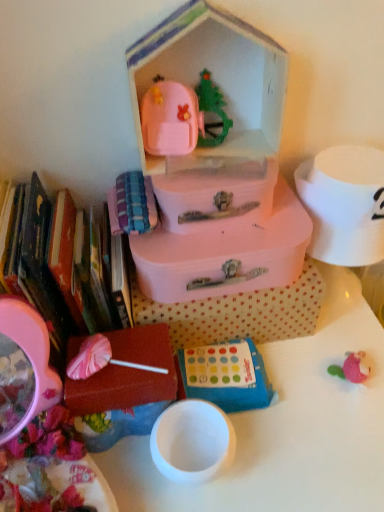
Where is `matte pink suitcase at center, arranged as the second storage box when viewed from the top`? This screenshot has width=384, height=512. matte pink suitcase at center, arranged as the second storage box when viewed from the top is located at coordinates (224, 254).

Find the location of `pink matte lollipop at lower left, the 1th storage box ordered from the bottom`. pink matte lollipop at lower left, the 1th storage box ordered from the bottom is located at coordinates (127, 373).

Where is `matte pink book at left`? This screenshot has height=512, width=384. matte pink book at left is located at coordinates (70, 268).

Describe the element at coordinates (227, 376) in the screenshot. I see `blue fabric game at center` at that location.

How much space does matte pink suitcase at center, which is the 4th storage box from bottom to top, occupy vertically?

matte pink suitcase at center, which is the 4th storage box from bottom to top, is 4.08 inches tall.

Find the location of a particular element. pink matte suitcase at center, the 2th storage box in the bottom-to-top sequence is located at coordinates (238, 313).

Is matte pink book at left in contact with matte pink suitcase at center, arranged as the second storage box when viewed from the top?

matte pink book at left and matte pink suitcase at center, arranged as the second storage box when viewed from the top, are clearly separated.

At what (x,y) coordinates should I click in order to perform the action: click on book lying below the matte pink suitcase at center, arranged as the second storage box when viewed from the top (from the image's perspective). Please return your answer as a coordinate pair (x, y). The height and width of the screenshot is (512, 384). Looking at the image, I should click on (70, 268).

Does matte pink book at left have a lesser width compared to matte pink suitcase at center, arranged as the 3th storage box when ordered from the bottom?

Incorrect, the width of matte pink book at left is not less than that of matte pink suitcase at center, arranged as the 3th storage box when ordered from the bottom.

From the matte pink suitcase at center, arranged as the 3th storage box when ordered from the bottom, count 2nd storage box to the right and point to it. Please provide its 2D coordinates.

[(238, 313)]

Looking at their sizes, would you say matte pink suitcase at center, arranged as the second storage box when viewed from the top, is wider or thinner than pink matte suitcase at center, the 2th storage box in the bottom-to-top sequence?

Clearly, matte pink suitcase at center, arranged as the second storage box when viewed from the top, has more width compared to pink matte suitcase at center, the 2th storage box in the bottom-to-top sequence.

Is matte pink suitcase at center, arranged as the 3th storage box when ordered from the bottom, beside pink matte suitcase at center, the 2th storage box in the bottom-to-top sequence?

Yes, matte pink suitcase at center, arranged as the 3th storage box when ordered from the bottom, is next to pink matte suitcase at center, the 2th storage box in the bottom-to-top sequence.

From a real-world perspective, relative to pink matte suitcase at center, the third storage box positioned from the top, is matte pink suitcase at center, arranged as the second storage box when viewed from the top, vertically above or below?

From a real-world perspective, matte pink suitcase at center, arranged as the second storage box when viewed from the top, is physically above pink matte suitcase at center, the third storage box positioned from the top.

Looking at their sizes, would you say pink matte suitcase at center, the third storage box positioned from the top, is wider or thinner than matte pink suitcase at center, which is the 4th storage box from bottom to top?

Clearly, pink matte suitcase at center, the third storage box positioned from the top, has less width compared to matte pink suitcase at center, which is the 4th storage box from bottom to top.

Which point is more forward, [281,333] or [162,215]?

The point [162,215] is more forward.

From the image's perspective, is pink matte suitcase at center, the 2th storage box in the bottom-to-top sequence, beneath matte pink suitcase at center, which is the 4th storage box from bottom to top?

Indeed, from the image's perspective, pink matte suitcase at center, the 2th storage box in the bottom-to-top sequence, is shown beneath matte pink suitcase at center, which is the 4th storage box from bottom to top.

In the scene shown: Is pink matte suitcase at center, the 2th storage box in the bottom-to-top sequence, positioned with its back to matte pink suitcase at center, positioned as the 1th storage box in top-to-bottom order?

pink matte suitcase at center, the 2th storage box in the bottom-to-top sequence, is not turned away from matte pink suitcase at center, positioned as the 1th storage box in top-to-bottom order.

From the image's perspective, is pink plastic suitcase at upper center over matte pink book at left?

Yes, from the image's perspective, pink plastic suitcase at upper center is over matte pink book at left.

Which object is thinner, pink plastic suitcase at upper center or matte pink book at left?

pink plastic suitcase at upper center is thinner.

Does pink plastic suitcase at upper center come behind matte pink book at left?

No, it is in front of matte pink book at left.

What's the angular difference between pink plastic suitcase at upper center and matte pink book at left's facing directions?

There is a 0.000755-degree angle between the facing directions of pink plastic suitcase at upper center and matte pink book at left.

Considering the sizes of matte pink suitcase at center, arranged as the second storage box when viewed from the top, and matte pink suitcase at center, which is the 4th storage box from bottom to top, in the image, is matte pink suitcase at center, arranged as the second storage box when viewed from the top, bigger or smaller than matte pink suitcase at center, which is the 4th storage box from bottom to top,?

In the image, matte pink suitcase at center, arranged as the second storage box when viewed from the top, appears to be larger than matte pink suitcase at center, which is the 4th storage box from bottom to top.

Is matte pink suitcase at center, arranged as the 3th storage box when ordered from the bottom, located outside matte pink suitcase at center, which is the 4th storage box from bottom to top?

Absolutely, matte pink suitcase at center, arranged as the 3th storage box when ordered from the bottom, is external to matte pink suitcase at center, which is the 4th storage box from bottom to top.

From a real-world perspective, is matte pink suitcase at center, arranged as the 3th storage box when ordered from the bottom, located higher than matte pink suitcase at center, which is the 4th storage box from bottom to top?

No, from a real-world perspective, matte pink suitcase at center, arranged as the 3th storage box when ordered from the bottom, is not over matte pink suitcase at center, which is the 4th storage box from bottom to top

Can you confirm if white glossy table at center is wider than blue fabric game at center?

Yes.

Does white glossy table at center turn towards blue fabric game at center?

No, white glossy table at center is not facing towards blue fabric game at center.

Visually, is white glossy table at center positioned to the left or to the right of blue fabric game at center?

Clearly, white glossy table at center is on the left of blue fabric game at center in the image.

Measure the distance between white glossy table at center and blue fabric game at center.

The distance of white glossy table at center from blue fabric game at center is 4.35 inches.

Can you confirm if pink matte lollipop at lower left, which is counted as the 4th storage box, starting from the top, is bigger than matte pink suitcase at center, arranged as the second storage box when viewed from the top?

No, pink matte lollipop at lower left, which is counted as the 4th storage box, starting from the top, is not bigger than matte pink suitcase at center, arranged as the second storage box when viewed from the top.

Is the depth of pink matte lollipop at lower left, the 1th storage box ordered from the bottom, less than that of matte pink suitcase at center, arranged as the second storage box when viewed from the top?

Yes, pink matte lollipop at lower left, the 1th storage box ordered from the bottom, is closer to the camera.

Is pink matte lollipop at lower left, the 1th storage box ordered from the bottom, facing towards matte pink suitcase at center, arranged as the 3th storage box when ordered from the bottom?

No, pink matte lollipop at lower left, the 1th storage box ordered from the bottom, does not turn towards matte pink suitcase at center, arranged as the 3th storage box when ordered from the bottom.

Considering the positions of objects pink matte lollipop at lower left, the 1th storage box ordered from the bottom, and matte pink suitcase at center, arranged as the second storage box when viewed from the top, in the image provided, who is more to the right, pink matte lollipop at lower left, the 1th storage box ordered from the bottom, or matte pink suitcase at center, arranged as the second storage box when viewed from the top,?

matte pink suitcase at center, arranged as the second storage box when viewed from the top.

This screenshot has height=512, width=384. Identify the location of the 2nd storage box to the right of the matte pink book at left, starting your count from the anchor. (224, 254).

Locate an element on the screen. the 1st storage box above the pink matte suitcase at center, the 2th storage box in the bottom-to-top sequence (from the image's perspective) is located at coordinates (224, 254).

Based on their spatial positions, is matte pink suitcase at center, which is the 4th storage box from bottom to top, or matte pink book at left further from pink plastic suitcase at upper center?

matte pink book at left is positioned further to the anchor pink plastic suitcase at upper center.

Based on their spatial positions, is matte pink book at left or blue fabric game at center closer to pink matte suitcase at center, the third storage box positioned from the top?

The object closer to pink matte suitcase at center, the third storage box positioned from the top, is blue fabric game at center.

Which object lies further to the anchor point matte pink suitcase at center, arranged as the second storage box when viewed from the top, pink plastic suitcase at upper center or blue fabric game at center?

The object further to matte pink suitcase at center, arranged as the second storage box when viewed from the top, is blue fabric game at center.

Which object lies nearer to the anchor point pink plastic suitcase at upper center, matte pink book at left or pink matte lollipop at lower left, the 1th storage box ordered from the bottom?

The object closer to pink plastic suitcase at upper center is matte pink book at left.

Based on their spatial positions, is pink matte lollipop at lower left, the 1th storage box ordered from the bottom, or blue fabric game at center further from matte pink suitcase at center, which is the 4th storage box from bottom to top?

blue fabric game at center lies further to matte pink suitcase at center, which is the 4th storage box from bottom to top, than the other object.

Considering their positions, is pink matte lollipop at lower left, the 1th storage box ordered from the bottom, positioned further to matte pink suitcase at center, which is the 4th storage box from bottom to top, than pink matte suitcase at center, the 2th storage box in the bottom-to-top sequence?

pink matte lollipop at lower left, the 1th storage box ordered from the bottom, lies further to matte pink suitcase at center, which is the 4th storage box from bottom to top, than the other object.

Which object lies further to the anchor point blue fabric game at center, matte pink book at left or pink plastic suitcase at upper center?

Among the two, pink plastic suitcase at upper center is located further to blue fabric game at center.

From the image, which object appears to be nearer to white glossy table at center, matte pink suitcase at center, arranged as the 3th storage box when ordered from the bottom, or blue fabric game at center?

blue fabric game at center lies closer to white glossy table at center than the other object.

Find the location of a particular element. The height and width of the screenshot is (512, 384). storage box between pink plastic suitcase at upper center and matte pink suitcase at center, arranged as the second storage box when viewed from the top, from top to bottom is located at coordinates (215, 196).

Locate an element on the screen. The height and width of the screenshot is (512, 384). box between matte pink book at left and matte pink suitcase at center, arranged as the 3th storage box when ordered from the bottom, in the horizontal direction is located at coordinates (218, 164).

The image size is (384, 512). Find the location of `toy between pink matte suitcase at center, the third storage box positioned from the top, and white glossy table at center vertically`. toy between pink matte suitcase at center, the third storage box positioned from the top, and white glossy table at center vertically is located at coordinates (227, 376).

At what (x,y) coordinates should I click in order to perform the action: click on toy between pink plastic suitcase at upper center and white glossy table at center from top to bottom. Please return your answer as a coordinate pair (x, y). This screenshot has width=384, height=512. Looking at the image, I should click on (227, 376).